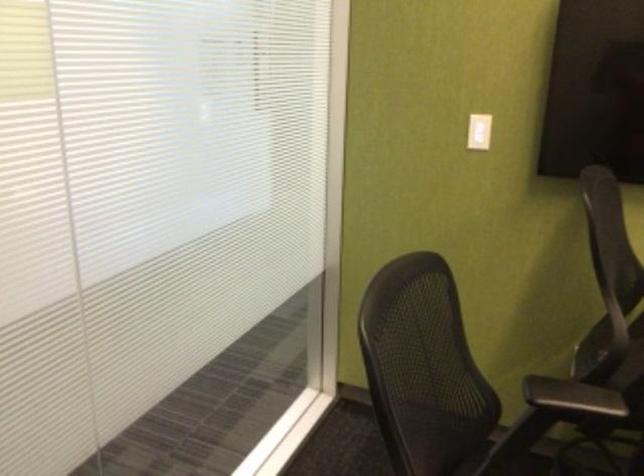
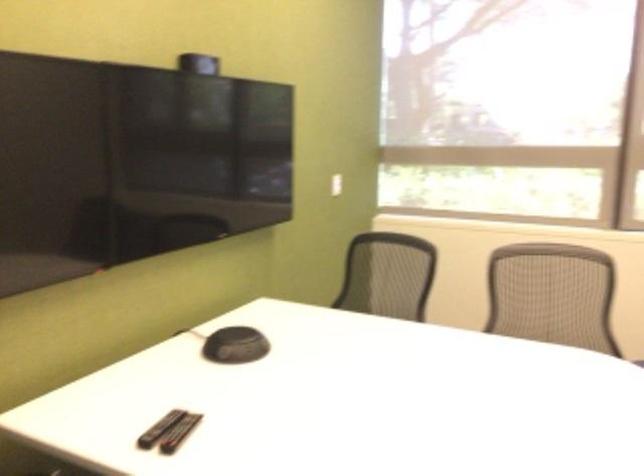
Question: Based on the continuous images, in which direction is the camera rotating? Reply with the corresponding letter.

Choices:
 (A) Left
 (B) Right
 (C) Up
 (D) Down

Answer: (B)